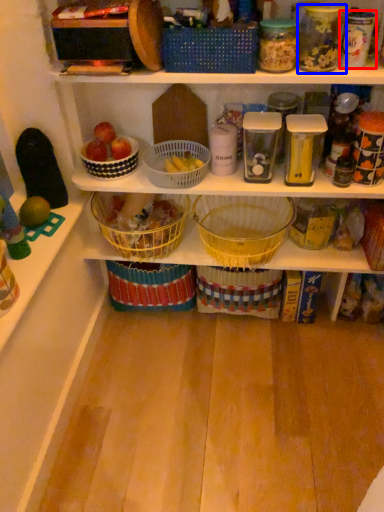
Question: Which of the following is the farthest to the observer, glass jar (highlighted by a red box) or glass jar (highlighted by a blue box)?

Choices:
 (A) glass jar
 (B) glass jar

Answer: (A)